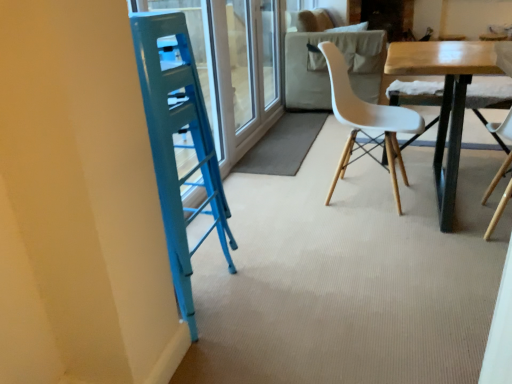
Question: Is white matte plastic chair at center oriented towards transparent glass screen door at upper center?

Choices:
 (A) no
 (B) yes

Answer: (A)

Question: From the image's perspective, is white matte plastic chair at center beneath transparent glass screen door at upper center?

Choices:
 (A) yes
 (B) no

Answer: (A)

Question: Does white matte plastic chair at center lie in front of transparent glass screen door at upper center?

Choices:
 (A) yes
 (B) no

Answer: (A)

Question: Is white matte plastic chair at center shorter than transparent glass screen door at upper center?

Choices:
 (A) yes
 (B) no

Answer: (A)

Question: Does white matte plastic chair at center appear on the left side of transparent glass screen door at upper center?

Choices:
 (A) no
 (B) yes

Answer: (A)

Question: From a real-world perspective, is white matte plastic chair at center over transparent glass screen door at upper center?

Choices:
 (A) no
 (B) yes

Answer: (A)

Question: Considering the relative sizes of transparent glass screen door at upper center and white matte plastic chair at center in the image provided, is transparent glass screen door at upper center shorter than white matte plastic chair at center?

Choices:
 (A) no
 (B) yes

Answer: (A)

Question: From a real-world perspective, does transparent glass screen door at upper center sit lower than white matte plastic chair at center?

Choices:
 (A) no
 (B) yes

Answer: (A)

Question: Does transparent glass screen door at upper center have a greater width compared to white matte plastic chair at center?

Choices:
 (A) no
 (B) yes

Answer: (A)

Question: Considering the relative sizes of transparent glass screen door at upper center and white matte plastic chair at center in the image provided, is transparent glass screen door at upper center bigger than white matte plastic chair at center?

Choices:
 (A) no
 (B) yes

Answer: (A)

Question: Can you confirm if transparent glass screen door at upper center is positioned to the right of white matte plastic chair at center?

Choices:
 (A) no
 (B) yes

Answer: (A)

Question: Is transparent glass screen door at upper center further to the viewer compared to white matte plastic chair at center?

Choices:
 (A) yes
 (B) no

Answer: (A)

Question: Is transparent glass screen door at upper center in contact with wooden table at center?

Choices:
 (A) no
 (B) yes

Answer: (A)